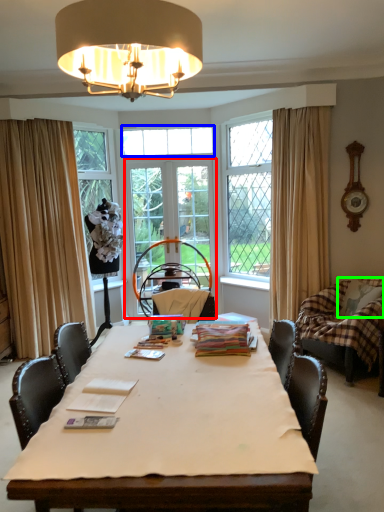
Question: Which is nearer to the screen door (highlighted by a red box)? window (highlighted by a blue box) or pillow (highlighted by a green box).

Choices:
 (A) window
 (B) pillow

Answer: (A)